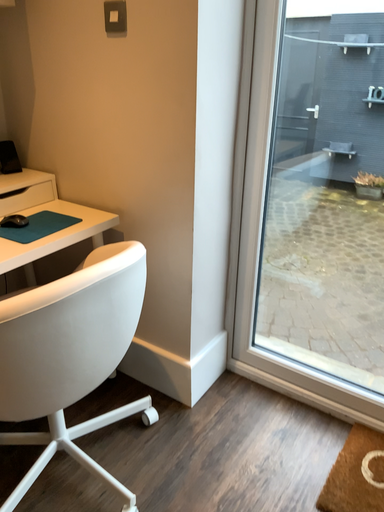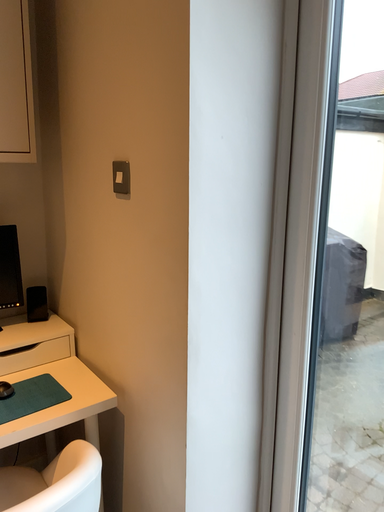
Question: Which way did the camera rotate in the video?

Choices:
 (A) rotated left
 (B) rotated right

Answer: (A)